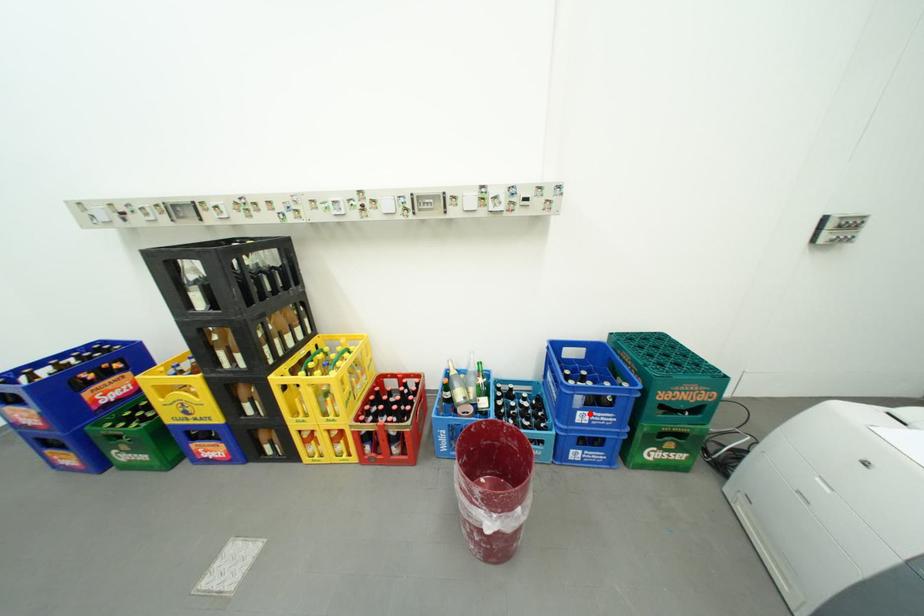
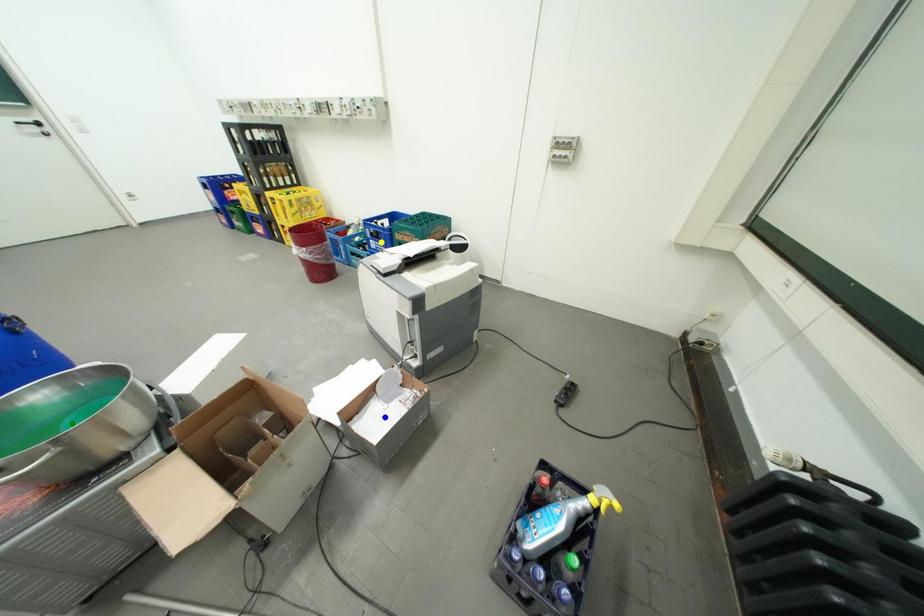
Question: I am providing you with two images of the same scene from different viewpoints. A red point is marked on the first image. You are given multiple points on the second image. Can you choose the point in image 2 that corresponds to the point in image 1?

Choices:
 (A) green point
 (B) blue point
 (C) yellow point

Answer: (C)